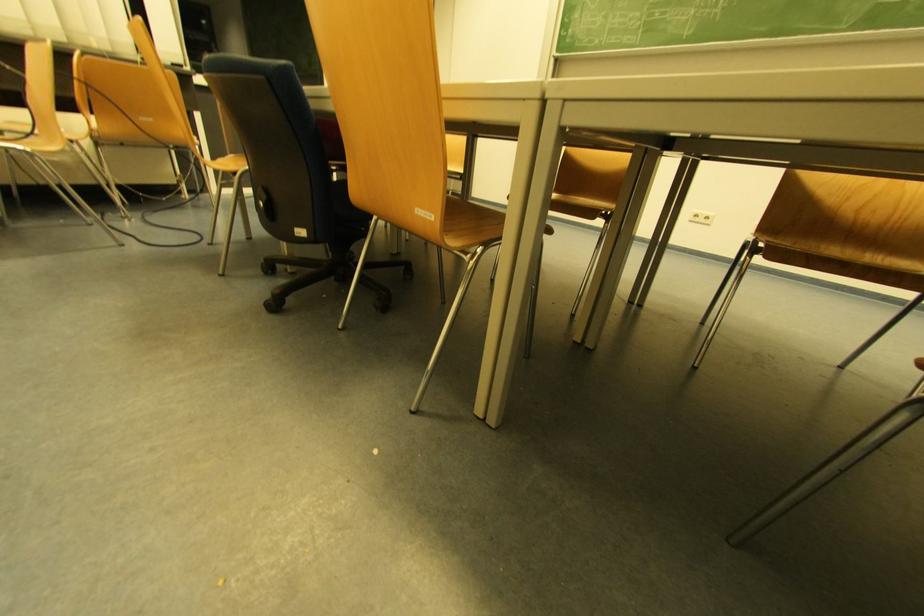
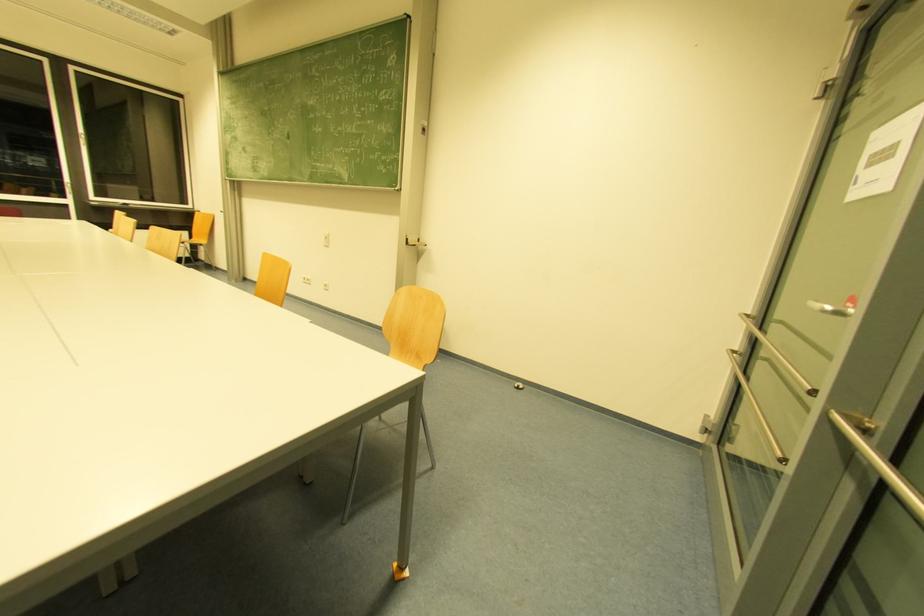
In a continuous first-person perspective shot, in which direction is the camera moving?

The cameraman moved toward right, backward.